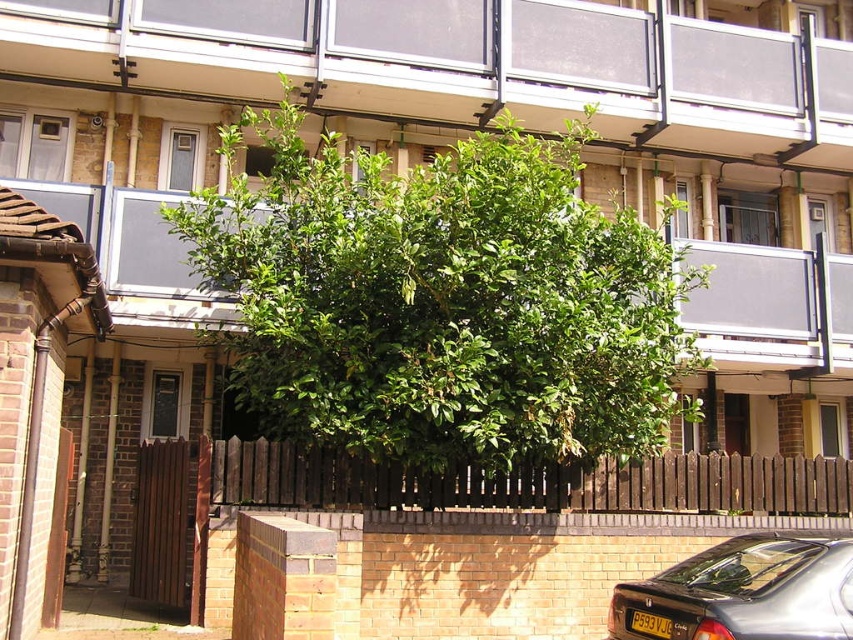
You are a delivery person trying to park your metallic gray car at lower right near the green leafy tree at center. Can you park the car directly in front of the tree without blocking the garden fence?

The green leafy tree at center is located above the metallic gray car at lower right, meaning the tree is positioned higher up relative to the car. Since the car is at the lower right, you can park the metallic gray car at lower right near the green leafy tree at center without blocking the garden fence as they are vertically aligned with the tree above and the car below.